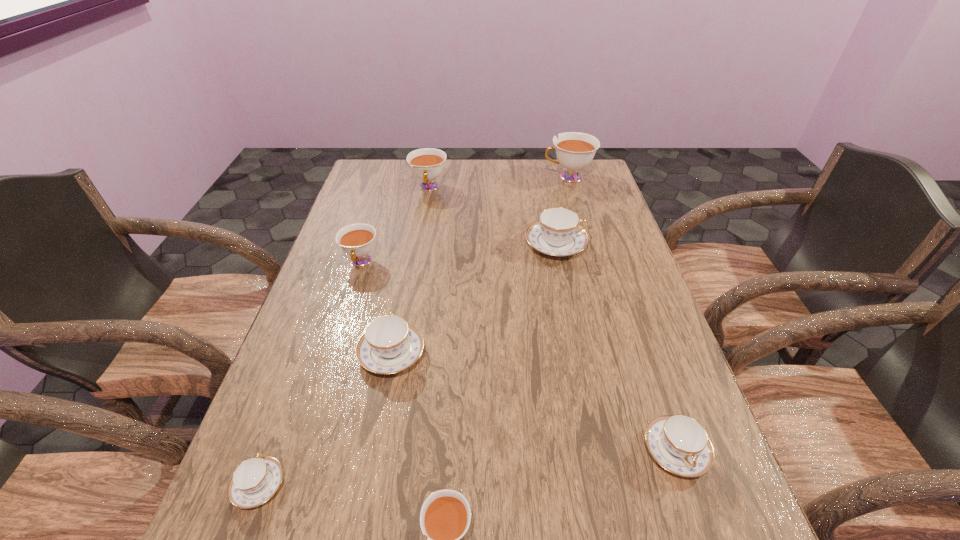
Where is `free spot between the leftmost white teacup and the second smallest blue teacup`? free spot between the leftmost white teacup and the second smallest blue teacup is located at coordinates (518, 356).

This screenshot has width=960, height=540. What are the coordinates of `vacant space that is in between the leftmost blue teacup and the second tallest teacup` in the screenshot? It's located at (344, 337).

This screenshot has width=960, height=540. In order to click on vacant area that lies between the third farthest white teacup and the shortest teacup in this screenshot , I will do `click(310, 374)`.

Select which object is the fourth closest to the biggest blue teacup. Please provide its 2D coordinates. Your answer should be formatted as a tuple, i.e. [(x, y)], where the tuple contains the x and y coordinates of a point satisfying the conditions above.

[(357, 240)]

The height and width of the screenshot is (540, 960). In order to click on object that is the third closest to the second farthest blue teacup in this screenshot , I will do [445, 516].

Where is `the third closest teacup to the second smallest blue teacup`? The image size is (960, 540). the third closest teacup to the second smallest blue teacup is located at coordinates click(557, 232).

Choose which teacup is the fifth nearest neighbor to the shortest teacup. Please provide its 2D coordinates. Your answer should be formatted as a tuple, i.e. [(x, y)], where the tuple contains the x and y coordinates of a point satisfying the conditions above.

[(557, 232)]

Select which white teacup appears as the third closest to the biggest blue teacup. Please provide its 2D coordinates. Your answer should be formatted as a tuple, i.e. [(x, y)], where the tuple contains the x and y coordinates of a point satisfying the conditions above.

[(357, 240)]

Select which white teacup appears as the third closest to the biggest blue teacup. Please provide its 2D coordinates. Your answer should be formatted as a tuple, i.e. [(x, y)], where the tuple contains the x and y coordinates of a point satisfying the conditions above.

[(357, 240)]

Identify which blue teacup is located as the fourth nearest to the rightmost white teacup. Please provide its 2D coordinates. Your answer should be formatted as a tuple, i.e. [(x, y)], where the tuple contains the x and y coordinates of a point satisfying the conditions above.

[(255, 480)]